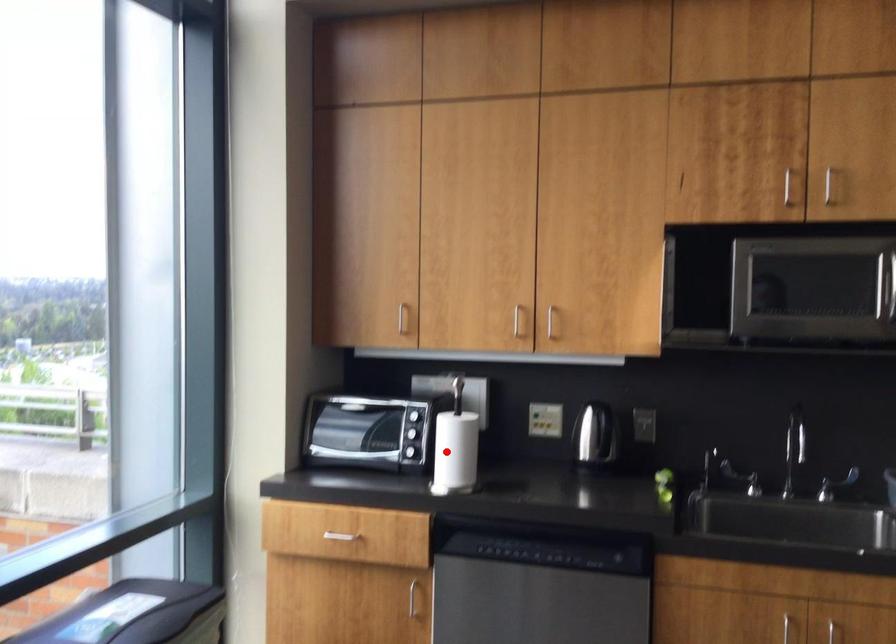
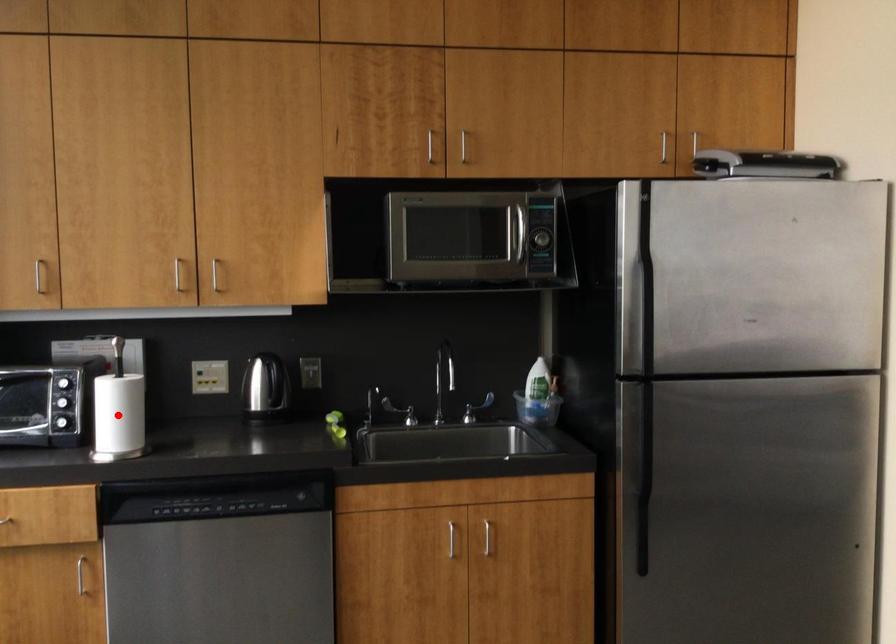
I am providing you with two images of the same scene from different viewpoints. A red point is marked on the first image and another point is marked on the second image. Is the marked point in image1 the same physical position as the marked point in image2?

Yes